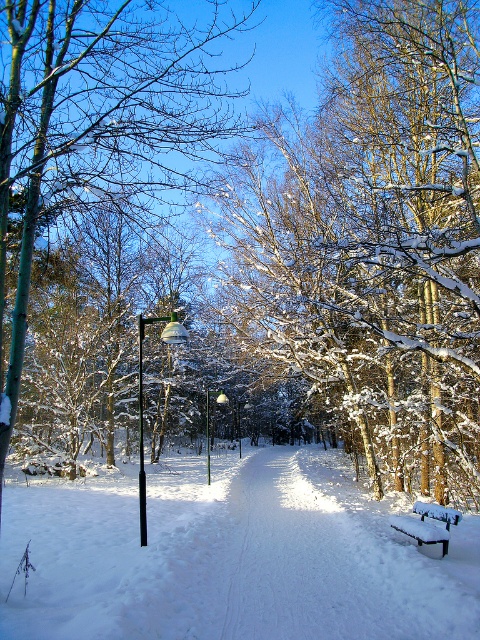
Which is in front, point (289, 108) or point (206, 448)?

Point (289, 108) is in front.

Is snow-covered trees at center bigger than metallic pole at center?

Indeed, snow-covered trees at center has a larger size compared to metallic pole at center.

Between point (456, 224) and point (208, 394), which one is positioned behind?

The point (208, 394) is behind.

This screenshot has height=640, width=480. I want to click on snow-covered trees at center, so click(x=372, y=237).

Can you confirm if snow-covered trees at center is positioned above white fluffy snow at center?

Yes, snow-covered trees at center is above white fluffy snow at center.

Is snow-covered trees at center taller than white fluffy snow at center?

Correct, snow-covered trees at center is much taller as white fluffy snow at center.

Is point (340, 70) behind point (80, 589)?

That is True.

Find the location of `snow-covered trees at center`. snow-covered trees at center is located at coordinates (x=372, y=237).

Looking at this image, is white fluffy snow at center positioned behind black metal lamp post at left?

No, white fluffy snow at center is in front of black metal lamp post at left.

Locate an element on the screen. The height and width of the screenshot is (640, 480). white fluffy snow at center is located at coordinates (230, 556).